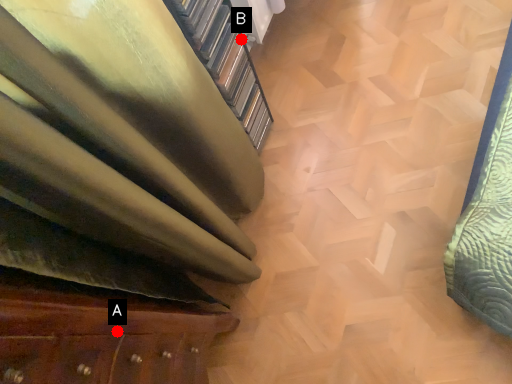
Question: Two points are circled on the image, labeled by A and B beside each circle. Which point is closer to the camera?

Choices:
 (A) A is closer
 (B) B is closer

Answer: (A)